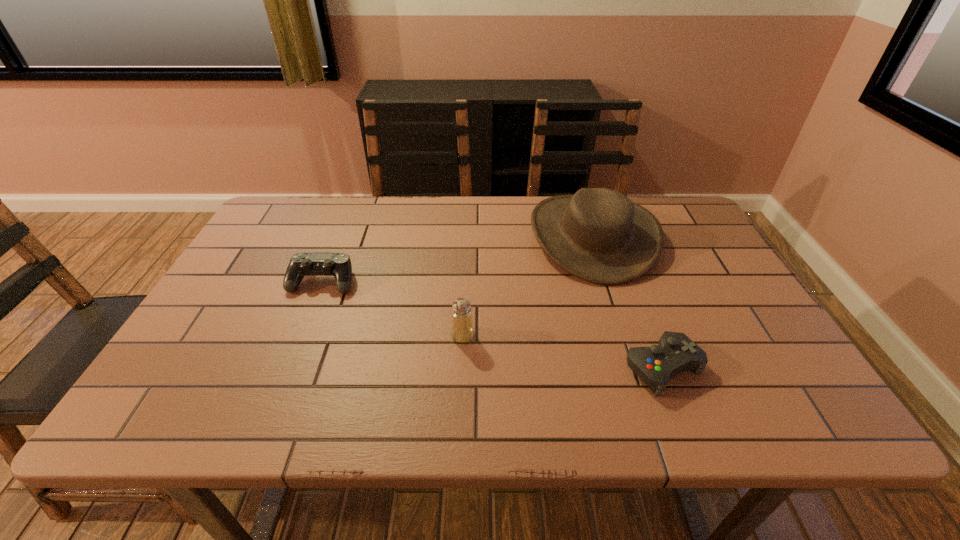
Find the location of `object present at the far edge`. object present at the far edge is located at coordinates (599, 235).

Identify the location of object at the near edge. Image resolution: width=960 pixels, height=540 pixels. (675, 352).

Where is `object positioned at the right edge`? The width and height of the screenshot is (960, 540). object positioned at the right edge is located at coordinates (599, 235).

You are a GUI agent. You are given a task and a screenshot of the screen. Output one action in this format:
    pyautogui.click(x=<x>, y=<y>)
    Task: Click on the object that is at the far right corner
    
    Given the screenshot: What is the action you would take?
    pyautogui.click(x=599, y=235)

In the image, there is a desktop. Identify the location of free space at the far edge. The width and height of the screenshot is (960, 540). (404, 220).

The height and width of the screenshot is (540, 960). In the image, there is a desktop. Find the location of `free space at the near edge`. free space at the near edge is located at coordinates (424, 407).

Locate an element on the screen. Image resolution: width=960 pixels, height=540 pixels. vacant area at the left edge is located at coordinates (252, 292).

Where is `vacant space at the right edge of the desktop`? This screenshot has height=540, width=960. vacant space at the right edge of the desktop is located at coordinates (763, 334).

Where is `free space at the far left corner`? free space at the far left corner is located at coordinates (291, 205).

In order to click on free space at the near left corner of the desktop in this screenshot , I will do `click(218, 391)`.